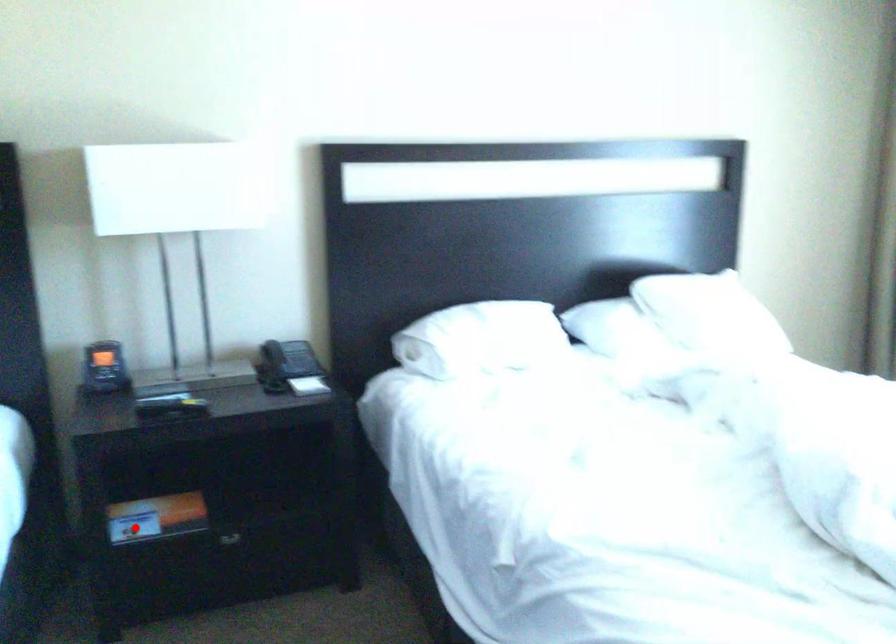
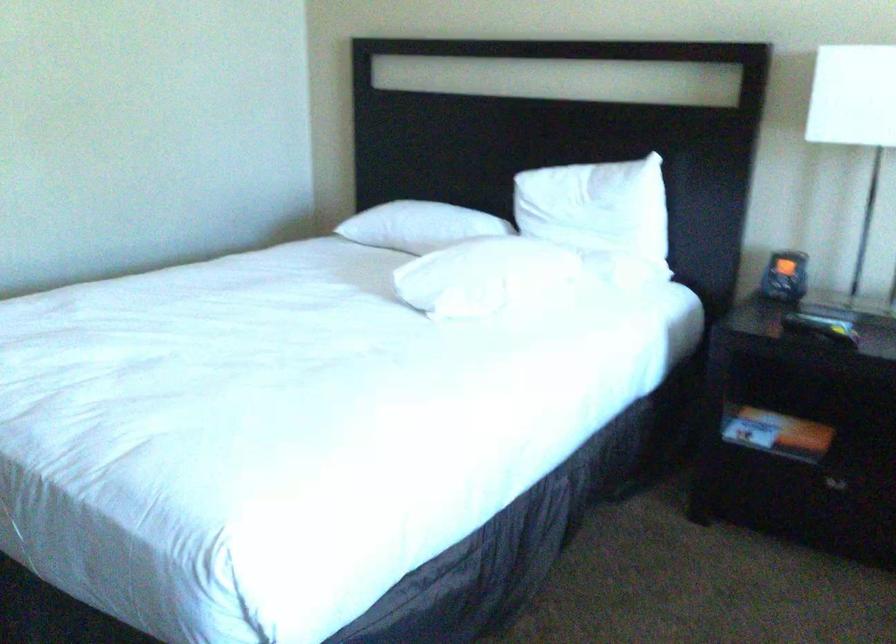
Locate, in the second image, the point that corresponds to the highlighted location in the first image.

(752, 427)